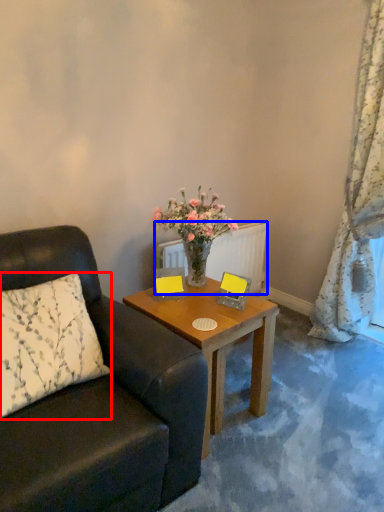
Question: Which object appears closest to the camera in this image, pillow (highlighted by a red box) or radiator (highlighted by a blue box)?

Choices:
 (A) pillow
 (B) radiator

Answer: (A)